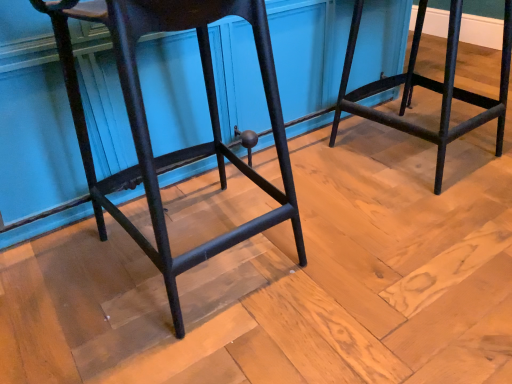
You are a GUI agent. You are given a task and a screenshot of the screen. Output one action in this format:
    pyautogui.click(x=<x>, y=<y>)
    Task: Click on the vacant region under black metal stool at right, the second furniture viewed from the left (from a real-world perspective)
    Image resolution: width=512 pixels, height=384 pixels.
    Given the screenshot: What is the action you would take?
    pyautogui.click(x=406, y=144)